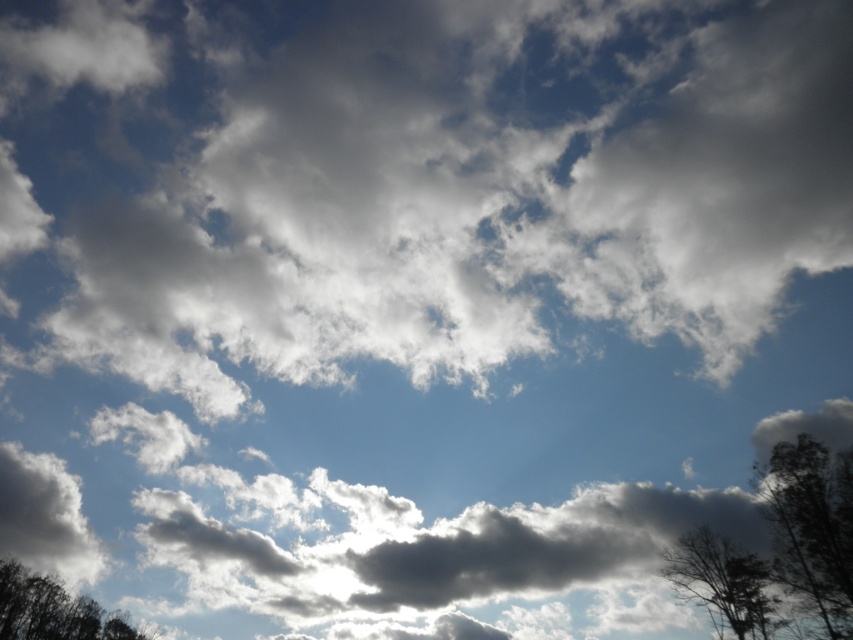
Does dark brown textured tree at lower right appear over dark green leafy tree at lower left?

Correct, dark brown textured tree at lower right is located above dark green leafy tree at lower left.

Is point (722, 611) farther from viewer compared to point (32, 625)?

No, (722, 611) is in front of (32, 625).

At what (x,y) coordinates should I click in order to perform the action: click on dark brown textured tree at lower right. Please return your answer as a coordinate pair (x, y). Looking at the image, I should click on (721, 580).

In order to click on dark brown textured tree at lower right in this screenshot , I will do `click(721, 580)`.

Which is more to the right, dark green leafy tree at lower right or dark brown textured tree at lower right?

dark green leafy tree at lower right

Looking at this image, is dark green leafy tree at lower right below dark brown textured tree at lower right?

No, dark green leafy tree at lower right is not below dark brown textured tree at lower right.

Between point (782, 522) and point (720, 573), which one is positioned behind?

Positioned behind is point (720, 573).

You are a GUI agent. You are given a task and a screenshot of the screen. Output one action in this format:
    pyautogui.click(x=<x>, y=<y>)
    Task: Click on the dark green leafy tree at lower right
    This screenshot has width=853, height=640.
    Given the screenshot: What is the action you would take?
    pyautogui.click(x=811, y=525)

Is dark green leafy tree at lower right smaller than dark green leafy tree at lower left?

Yes.

Can you confirm if dark green leafy tree at lower right is thinner than dark green leafy tree at lower left?

Yes, dark green leafy tree at lower right is thinner than dark green leafy tree at lower left.

Who is more forward, (822, 557) or (86, 616)?

Point (822, 557) is in front.

Locate an element on the screen. This screenshot has width=853, height=640. dark green leafy tree at lower right is located at coordinates (811, 525).